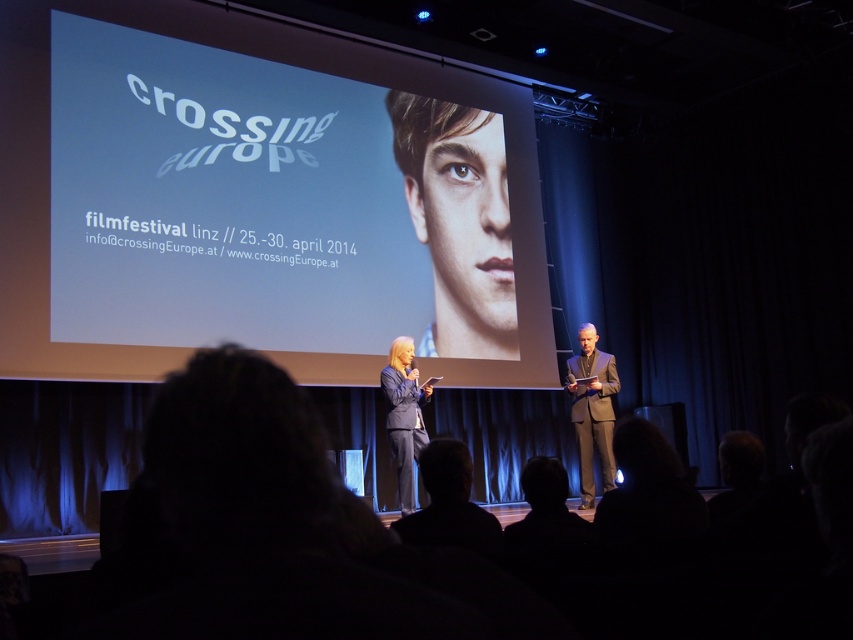
You are an event photographer who needs to capture both the smooth skin portrait at center and the dark gray suit at right in a single frame. Based on their positions and sizes, can you fit both subjects into your camera frame without zooming in or out?

The smooth skin portrait at center might be wider than dark gray suit at right, so it is possible to fit both into the frame as long as the camera is positioned to include both the wider portrait and the suit on the right side.

You are an attendee at the film festival event. You notice two points on the stage. Which point is closer to you, point (393, 182) or point (476, 221)?

Point (393, 182) is closer to the viewer than point (476, 221).

You are a photographer at the film festival event. You need to capture a photo of both the smooth skin portrait at center and the dark gray suit at right. Based on their positions, which object should you focus on first to ensure both are in frame?

The dark gray suit at right is behind the smooth skin portrait at center, so you should focus on the smooth skin portrait at center first to ensure both are in frame.